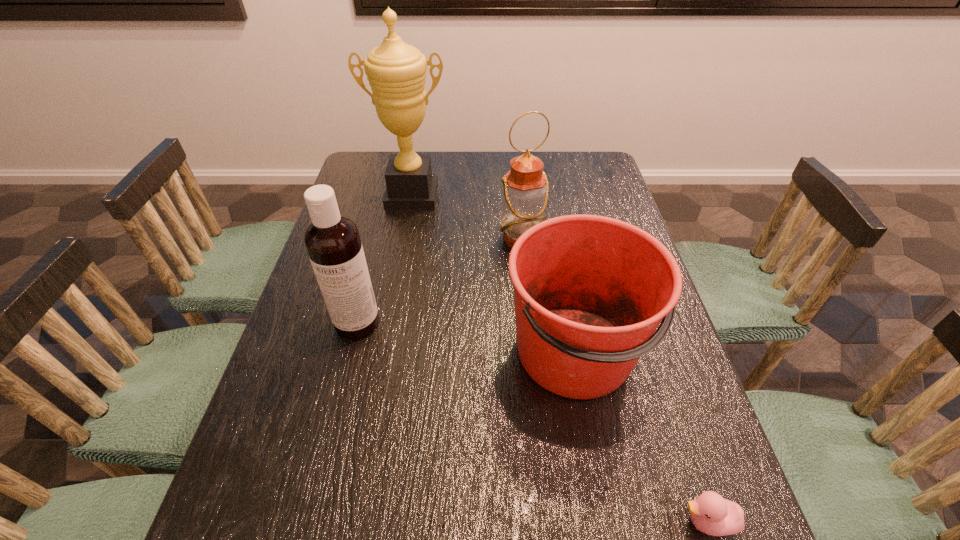
Find the location of a particular element. free location that satisfies the following two spatial constraints: 1. on the label side of the second shortest object; 2. on the right side of the dishwasher detergent is located at coordinates (350, 352).

Locate an element on the screen. The width and height of the screenshot is (960, 540). vacant space that satisfies the following two spatial constraints: 1. at the front of the tallest object with handles; 2. on the left side of the fourth nearest object is located at coordinates (404, 239).

In order to click on free space that satisfies the following two spatial constraints: 1. on the front side of the second farthest object; 2. on the left side of the bucket in this screenshot , I will do `click(533, 352)`.